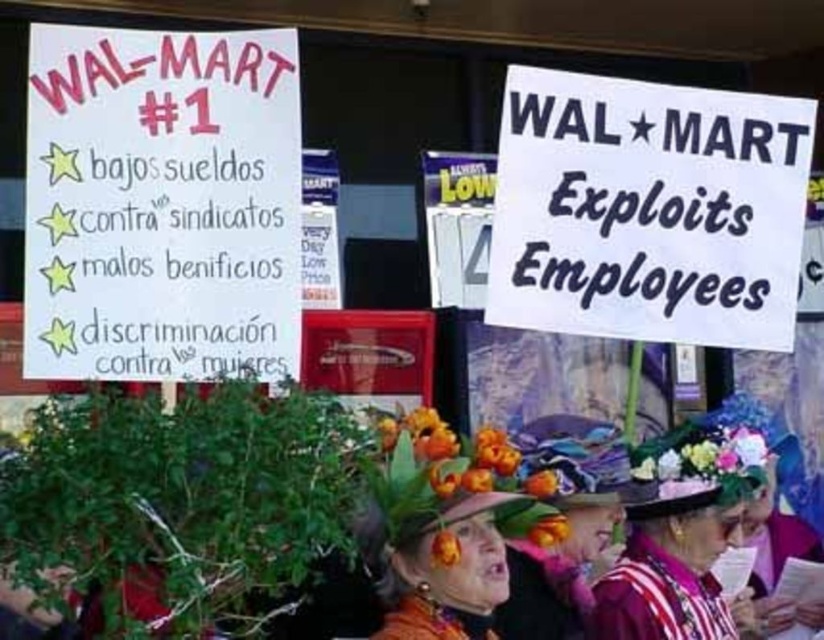
Question: Among these objects, which one is farthest from the camera?

Choices:
 (A) floral hat at center
 (B) floral fabric hat at center

Answer: (A)

Question: Which point is farther to the camera?

Choices:
 (A) floral hat at center
 (B) floral fabric hat at center

Answer: (A)

Question: Is floral fabric hat at center positioned in front of floral hat at center?

Choices:
 (A) yes
 (B) no

Answer: (A)

Question: Does floral fabric hat at center appear on the right side of floral hat at center?

Choices:
 (A) yes
 (B) no

Answer: (B)

Question: Which point appears farthest from the camera in this image?

Choices:
 (A) (391, 588)
 (B) (691, 544)

Answer: (B)

Question: Is floral fabric hat at center bigger than floral hat at center?

Choices:
 (A) no
 (B) yes

Answer: (A)